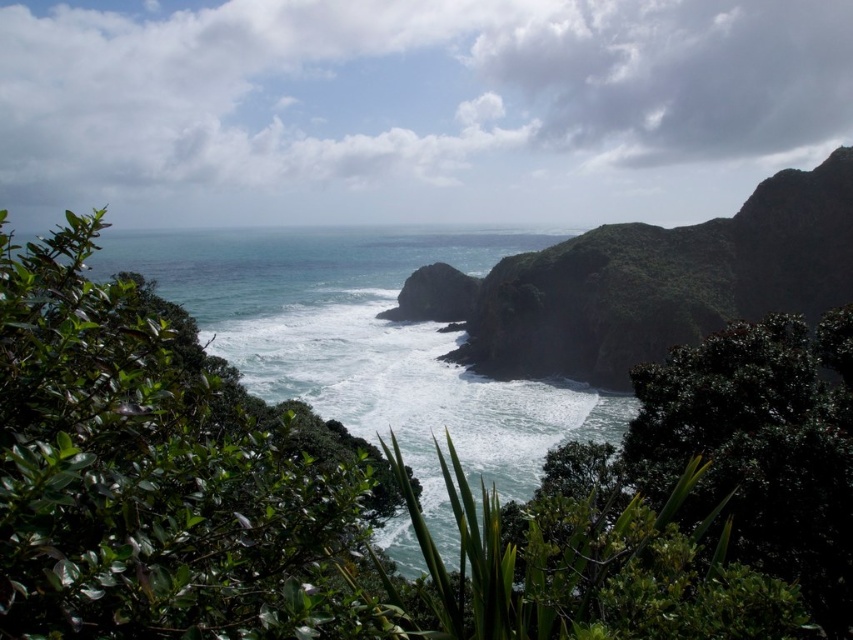
Between point (312, 364) and point (440, 289), which one is positioned in front?

Point (312, 364) is in front.

Can you confirm if greenish-blue water at center is positioned to the right of rough rock at center?

No, greenish-blue water at center is not to the right of rough rock at center.

What do you see at coordinates (369, 342) in the screenshot? The height and width of the screenshot is (640, 853). I see `greenish-blue water at center` at bounding box center [369, 342].

I want to click on greenish-blue water at center, so click(369, 342).